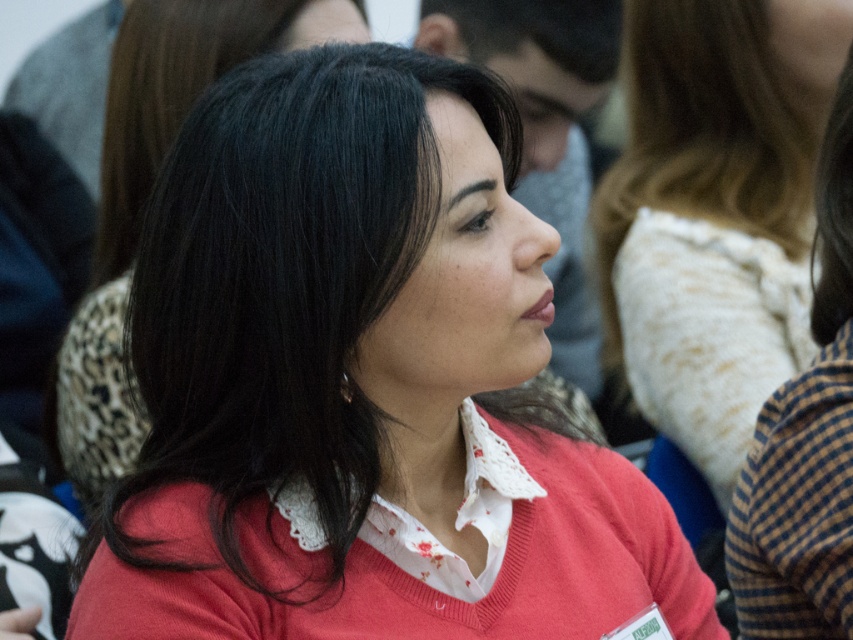
You are organizing a photo shoot and need to ensure that the matte red sweater at center and the black silky hair at upper right are at least 24 inches apart for proper lighting. Can you confirm if the current positioning meets this requirement?

The distance between the matte red sweater at center and the black silky hair at upper right is exactly 24.01 inches, which is just over the required 24 inches. Therefore, the current positioning meets the requirement.

You are a photographer trying to frame a shot that includes both the matte red sweater at center and the black silky hair at upper right. Which object should you adjust your camera angle to prioritize if you want to capture the wider object in the frame?

The matte red sweater at center is wider than the black silky hair at upper right, so you should prioritize framing the matte red sweater at center to capture its width.